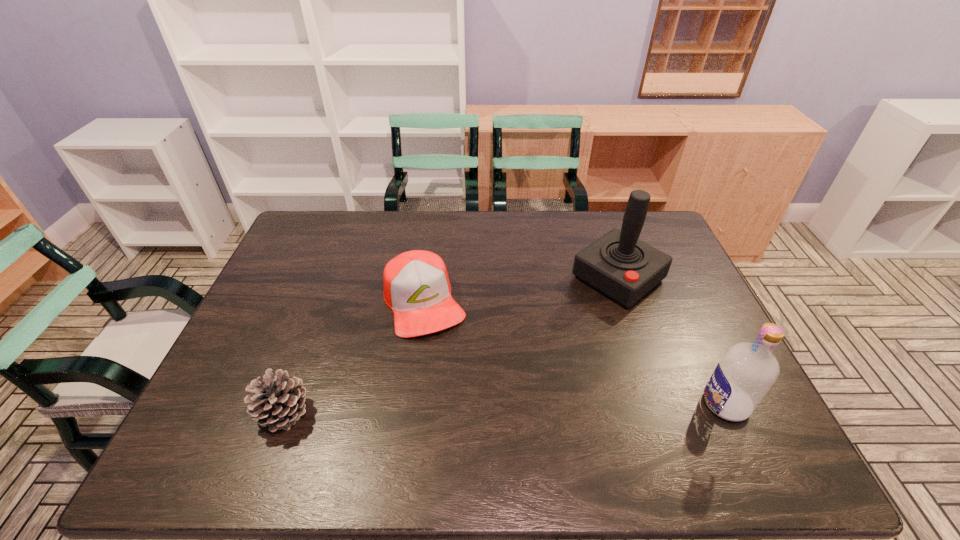
Find the location of a particular element. Image resolution: width=960 pixels, height=540 pixels. the leftmost object is located at coordinates (279, 401).

You are a GUI agent. You are given a task and a screenshot of the screen. Output one action in this format:
    pyautogui.click(x=<x>, y=<y>)
    Task: Click on the second tallest object
    The width and height of the screenshot is (960, 540).
    Given the screenshot: What is the action you would take?
    pyautogui.click(x=747, y=371)

The width and height of the screenshot is (960, 540). Find the location of `the third object from right to left`. the third object from right to left is located at coordinates (416, 285).

The width and height of the screenshot is (960, 540). I want to click on joystick, so click(619, 265).

Locate an element on the screen. This screenshot has height=540, width=960. free region located 0.150m on the back of the pinecone is located at coordinates (310, 342).

Locate an element on the screen. This screenshot has height=540, width=960. vacant position located 0.070m on the label of the vodka is located at coordinates (674, 404).

Locate an element on the screen. vacant area situated 0.290m on the label of the vodka is located at coordinates (581, 404).

Where is `vacant region located on the label of the vodka`? vacant region located on the label of the vodka is located at coordinates (577, 404).

Find the location of a particular element. vacant space located on the front-facing side of the baseball cap is located at coordinates (444, 356).

Where is `blank area located on the front-facing side of the baseball cap`? The height and width of the screenshot is (540, 960). blank area located on the front-facing side of the baseball cap is located at coordinates (458, 387).